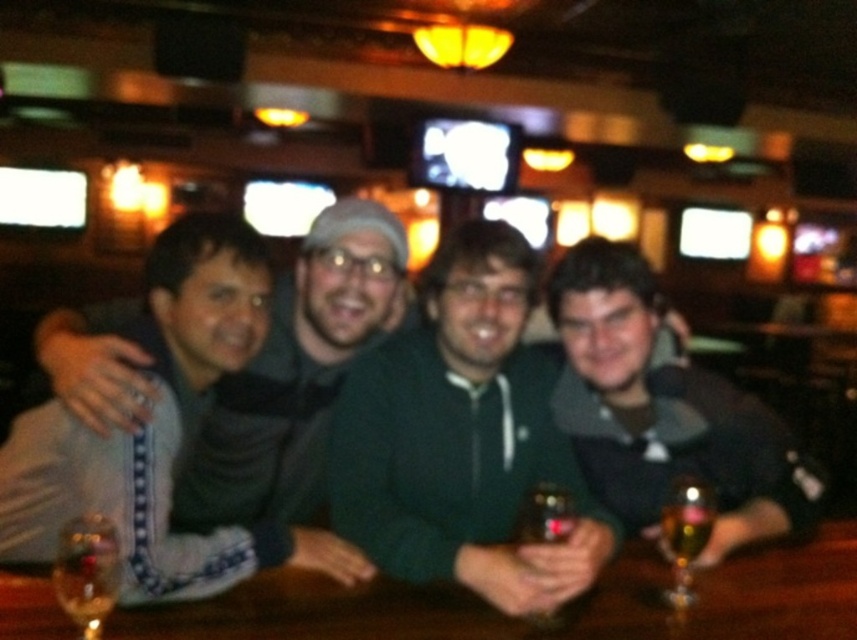
Question: Which point is closer to the camera taking this photo?

Choices:
 (A) pyautogui.click(x=87, y=545)
 (B) pyautogui.click(x=829, y=564)
 (C) pyautogui.click(x=687, y=513)

Answer: (A)

Question: Which point appears closest to the camera in this image?

Choices:
 (A) (63, 637)
 (B) (280, 312)
 (C) (507, 602)

Answer: (A)

Question: Can you confirm if green fleece jacket at center is bigger than dark gray hoodie at center?

Choices:
 (A) yes
 (B) no

Answer: (B)

Question: Which point is closer to the camera?

Choices:
 (A) (681, 509)
 (B) (648, 435)

Answer: (A)

Question: Is green zip-up hoodie at center above brown wooden table at center?

Choices:
 (A) yes
 (B) no

Answer: (A)

Question: Is translucent glass wine at lower left behind translucent glass beer at lower right?

Choices:
 (A) no
 (B) yes

Answer: (A)